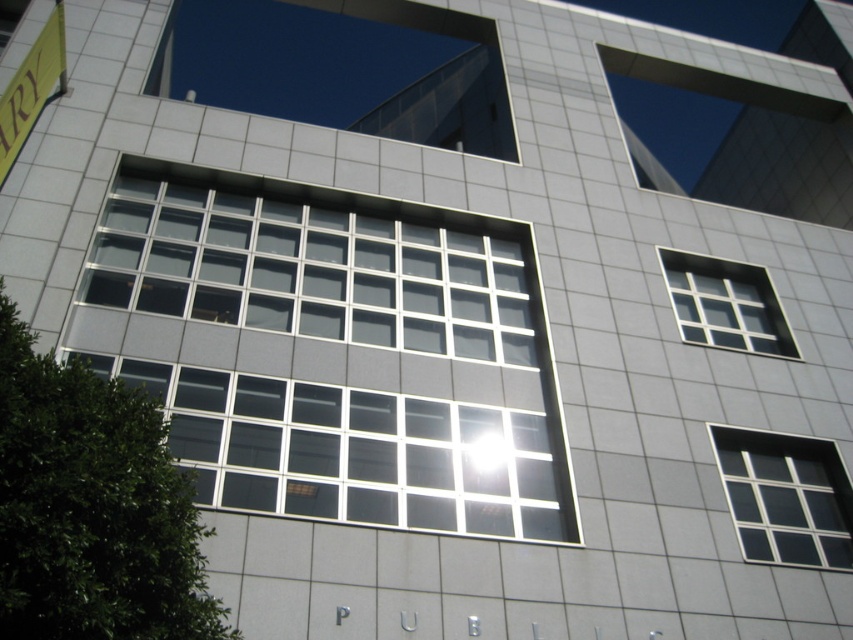
Question: Which object appears closest to the camera in this image?

Choices:
 (A) clear glass window at upper right
 (B) clear glass window at center right

Answer: (B)

Question: Which of the following is the farthest from the observer?

Choices:
 (A) clear glass window at upper right
 (B) clear glass window at center

Answer: (A)

Question: Can you confirm if clear glass window at center right is positioned to the right of clear glass window at upper right?

Choices:
 (A) no
 (B) yes

Answer: (A)

Question: Does clear glass window at center appear under clear glass window at center right?

Choices:
 (A) yes
 (B) no

Answer: (B)

Question: Does clear glass window at center have a lesser width compared to clear glass window at center right?

Choices:
 (A) yes
 (B) no

Answer: (B)

Question: Which object is positioned closest to the clear glass window at upper right?

Choices:
 (A) clear glass window at center right
 (B) clear glass window at center

Answer: (A)